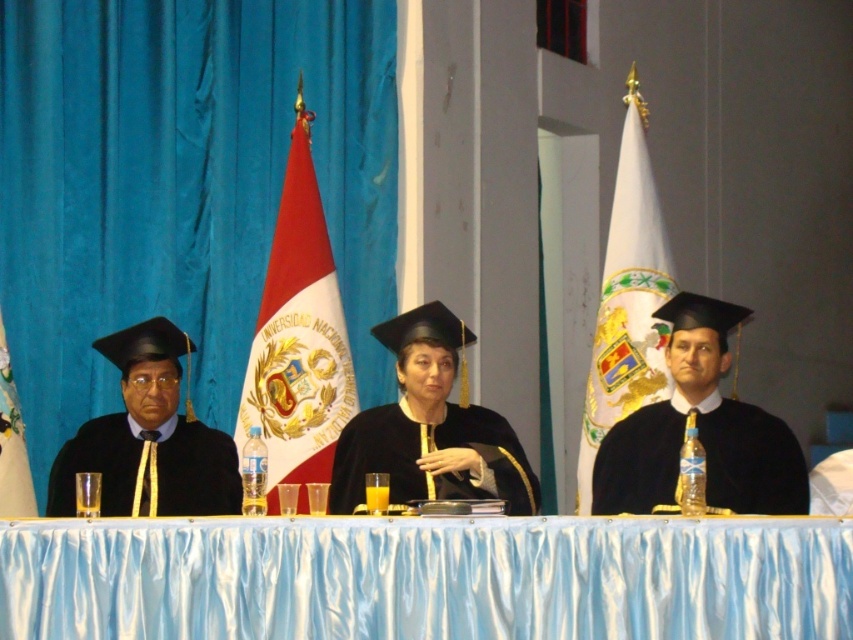
You are attending a graduation ceremony and notice two items on the left side of the stage. The matte black graduation gown at left and the white fabric flag at left. Which item is positioned higher?

The matte black graduation gown at left is above the white fabric flag at left, so the matte black graduation gown at left is positioned higher.

You are a photographer at the graduation ceremony. You want to capture a photo where the matte black graduation gown at left is clearly visible without being blocked by the white fabric flag at left. Based on the scene, can you position yourself in a way to achieve this?

Yes, because the matte black graduation gown at left is in front of the white fabric flag at left, positioning yourself so that you face the gown directly would ensure it remains visible and not obscured by the flag.

You are attending a graduation ceremony and notice two items on stage. The black matte graduation gown at center and the white fabric flag at left. Which item is positioned to the right of the other?

The black matte graduation gown at center is to the right of the white fabric flag at left.